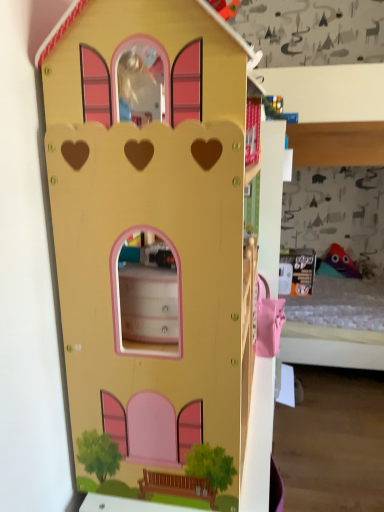
Identify the location of vacant point above multicolored fabric toy at right, positioned as the first toy in back-to-front order (from a real-world perspective). (339, 244).